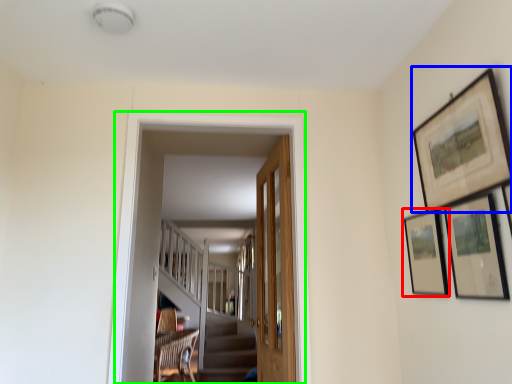
Question: Which object is positioned closest to picture frame (highlighted by a red box)? Select from picture frame (highlighted by a blue box) and corridor (highlighted by a green box).

Choices:
 (A) picture frame
 (B) corridor

Answer: (A)